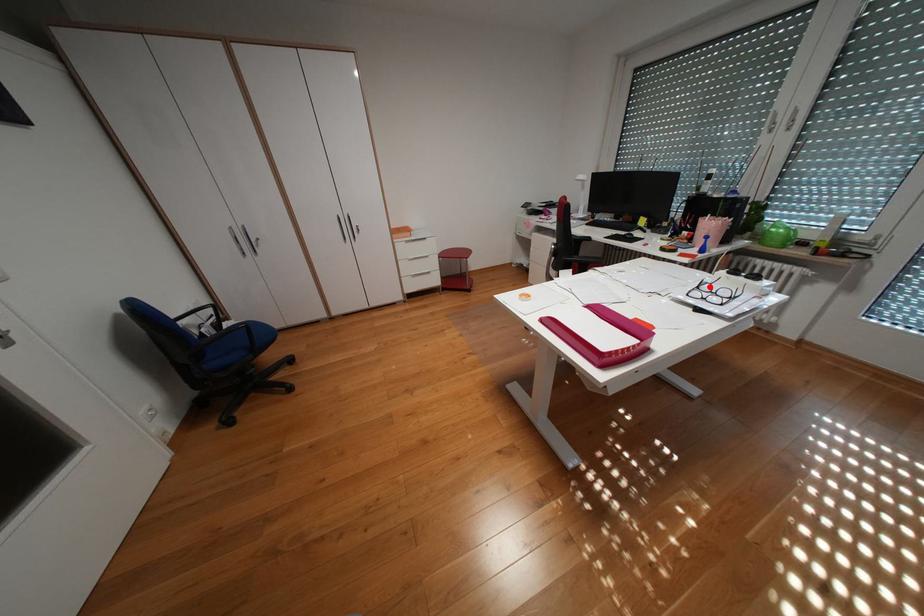
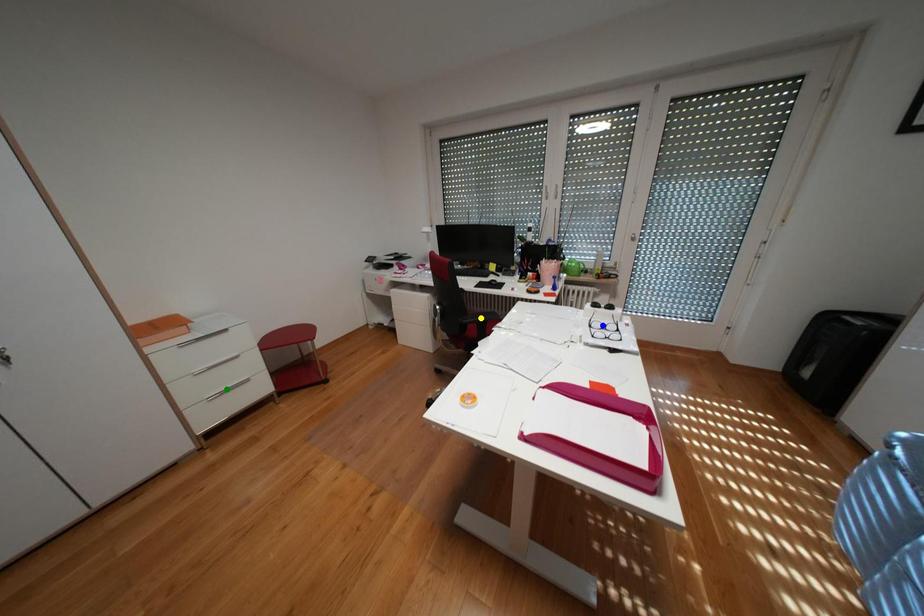
Question: I am providing you with two images of the same scene from different viewpoints. A red point is marked on the first image. You are given multiple points on the second image. Which point in image 2 represents the same 3d spot as the red point in image 1?

Choices:
 (A) yellow point
 (B) green point
 (C) blue point

Answer: (C)